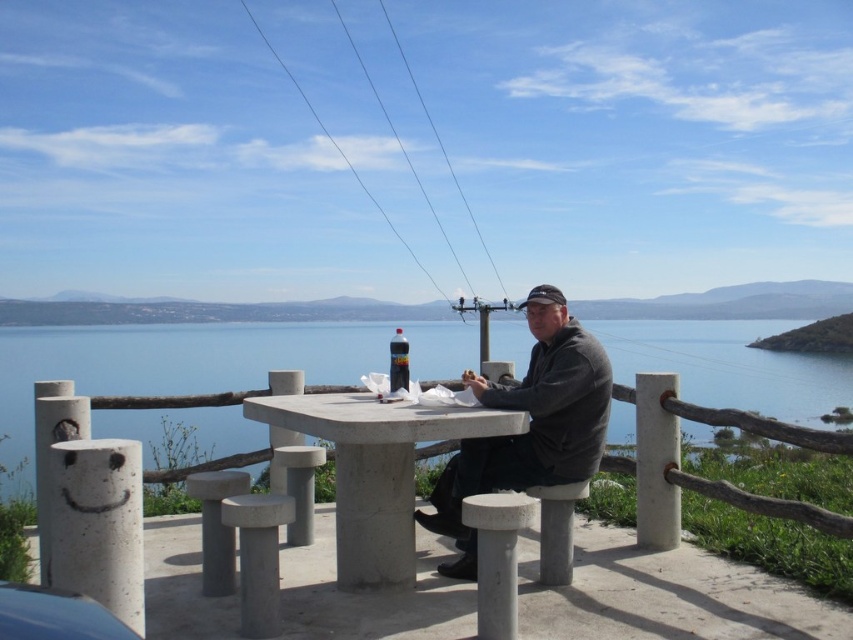
Which of these two, gray concrete stool at lower center or gray concrete stool at center, stands taller?

gray concrete stool at center

Can you confirm if gray concrete stool at lower center is wider than gray concrete stool at center?

No.

Does point (544, 552) lie in front of point (308, 509)?

Yes, point (544, 552) is closer to viewer.

Find the location of a particular element. The width and height of the screenshot is (853, 640). gray concrete stool at lower center is located at coordinates (556, 529).

Based on the photo, which of these two, blue water at table center or concrete at center, stands taller?

Standing taller between the two is blue water at table center.

Can you confirm if blue water at table center is thinner than concrete at center?

In fact, blue water at table center might be wider than concrete at center.

In order to click on blue water at table center in this screenshot , I will do `click(171, 364)`.

What are the coordinates of `blue water at table center` in the screenshot? It's located at (171, 364).

Does concrete/stone stool at lower center have a lesser width compared to gray concrete stool at center?

Yes, concrete/stone stool at lower center is thinner than gray concrete stool at center.

Can you confirm if concrete/stone stool at lower center is shorter than gray concrete stool at center?

Yes, concrete/stone stool at lower center is shorter than gray concrete stool at center.

Where is `concrete/stone stool at lower center`? The width and height of the screenshot is (853, 640). concrete/stone stool at lower center is located at coordinates (258, 557).

Where is `concrete/stone stool at lower center`? The width and height of the screenshot is (853, 640). concrete/stone stool at lower center is located at coordinates (258, 557).